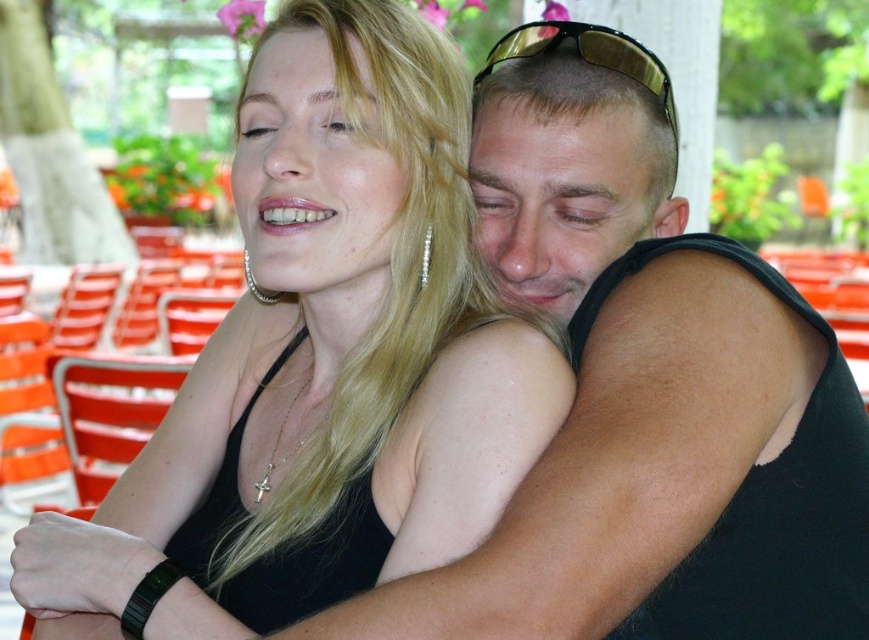
You are an artist preparing to sketch this scene. You notice the black matte tank top at center and the gold reflective sunglasses at upper center. Which object should you draw first if you want to start with the taller one?

The black matte tank top at center has a greater height compared to the gold reflective sunglasses at upper center, so you should draw the black matte tank top at center first.

You are a fashion designer trying to create a matching accessory set for the black matte tank top at center and the gold reflective sunglasses at upper center. Which object should you consider first to ensure the accessories complement their widths?

The black matte tank top at center is wider than the gold reflective sunglasses at upper center, so you should consider the tank top first to ensure the accessories match its width.